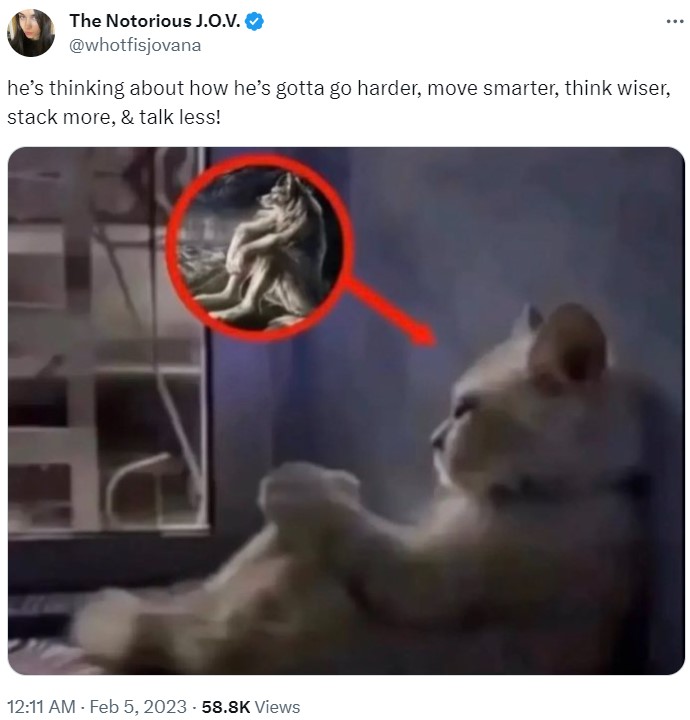
Image resolution: width=690 pixels, height=720 pixels. Identify the location of walls. (586, 189), (224, 186).